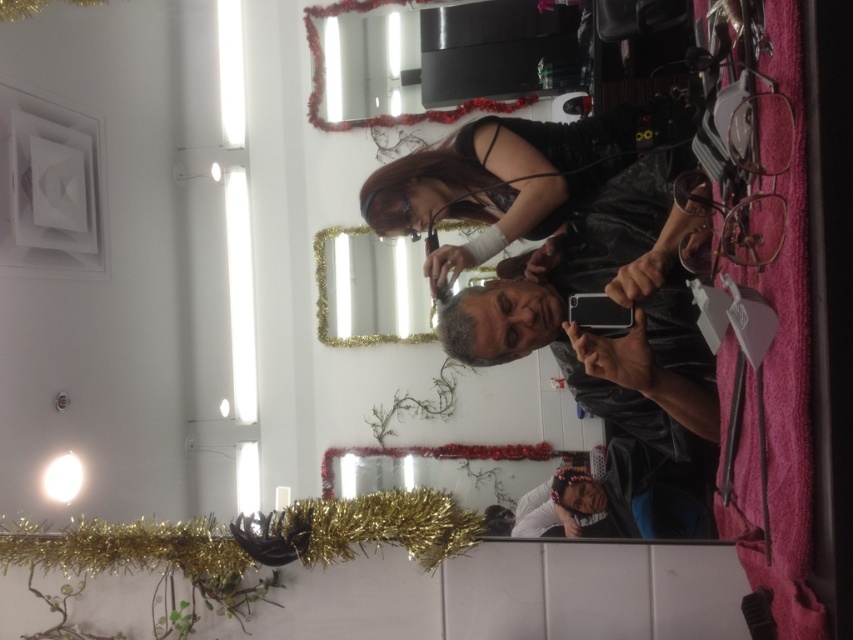
This screenshot has height=640, width=853. Describe the element at coordinates (518, 177) in the screenshot. I see `black leather jacket at center` at that location.

Is the position of black leather jacket at center less distant than that of gold glitter frame at center?

Yes, it is.

Where is `black leather jacket at center`? The image size is (853, 640). black leather jacket at center is located at coordinates (518, 177).

Where is `black leather jacket at center`? This screenshot has width=853, height=640. black leather jacket at center is located at coordinates (518, 177).

Does shiny black phone at center appear on the right side of gold glitter frame at center?

Correct, you'll find shiny black phone at center to the right of gold glitter frame at center.

This screenshot has width=853, height=640. What do you see at coordinates (613, 298) in the screenshot?
I see `shiny black phone at center` at bounding box center [613, 298].

Identify the location of shiny black phone at center. (613, 298).

Can you confirm if shiny black phone at center is positioned below black leather jacket at center?

Yes.

Between shiny black phone at center and black leather jacket at center, which one is positioned lower?

shiny black phone at center is below.

What do you see at coordinates (613, 298) in the screenshot? I see `shiny black phone at center` at bounding box center [613, 298].

Image resolution: width=853 pixels, height=640 pixels. What are the coordinates of `shiny black phone at center` in the screenshot? It's located at (613, 298).